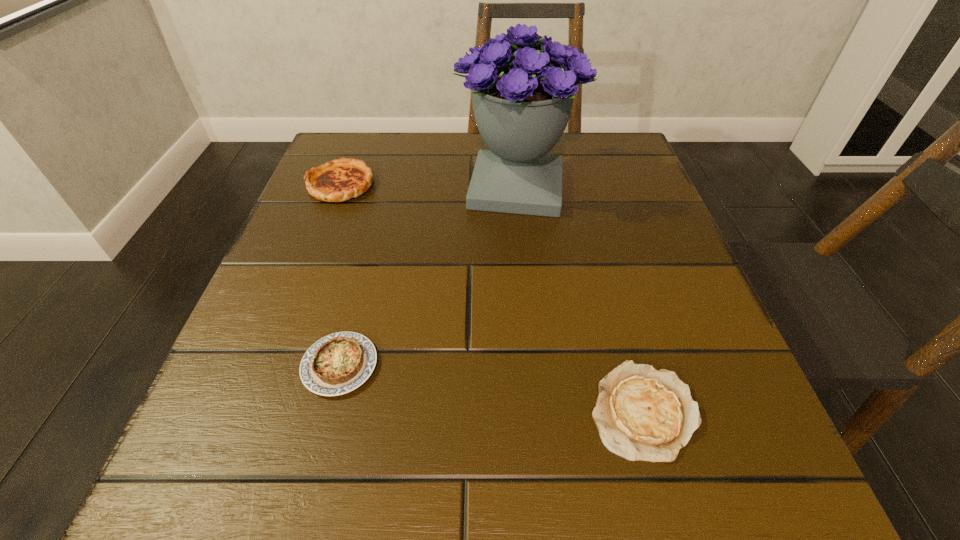
Identify the location of blank space at the near right corner. The width and height of the screenshot is (960, 540). (701, 465).

Locate an element on the screen. vacant space in between the rightmost quiche and the tallest object is located at coordinates point(579,299).

At what (x,y) coordinates should I click in order to perform the action: click on free space that is in between the rightmost quiche and the bouquet. Please return your answer as a coordinate pair (x, y). Image resolution: width=960 pixels, height=540 pixels. Looking at the image, I should click on (579, 299).

At what (x,y) coordinates should I click in order to perform the action: click on vacant area that lies between the bouquet and the farthest quiche. Please return your answer as a coordinate pair (x, y). This screenshot has width=960, height=540. Looking at the image, I should click on (428, 186).

Where is `free spot between the second tallest object and the rightmost quiche`? free spot between the second tallest object and the rightmost quiche is located at coordinates (492, 298).

Identify which object is the third nearest to the second tallest object. Please provide its 2D coordinates. Your answer should be formatted as a tuple, i.e. [(x, y)], where the tuple contains the x and y coordinates of a point satisfying the conditions above.

[(641, 413)]

The width and height of the screenshot is (960, 540). I want to click on object that can be found as the third closest to the tallest object, so point(641,413).

Find the location of `the closest quiche to the bouquet`. the closest quiche to the bouquet is located at coordinates [339, 180].

Identify which quiche is located as the third nearest to the bouquet. Please provide its 2D coordinates. Your answer should be formatted as a tuple, i.e. [(x, y)], where the tuple contains the x and y coordinates of a point satisfying the conditions above.

[(641, 413)]

You are a GUI agent. You are given a task and a screenshot of the screen. Output one action in this format:
    pyautogui.click(x=<x>, y=<y>)
    Task: Click on the free space that satisfies the following two spatial constraints: 1. on the front side of the tallest quiche; 2. on the left side of the rightmost quiche
    
    Given the screenshot: What is the action you would take?
    pyautogui.click(x=255, y=410)